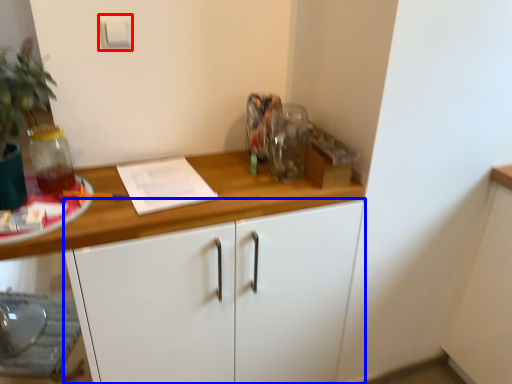
Question: Which of the following is the farthest to the observer, light switch (highlighted by a red box) or cabinetry (highlighted by a blue box)?

Choices:
 (A) light switch
 (B) cabinetry

Answer: (A)